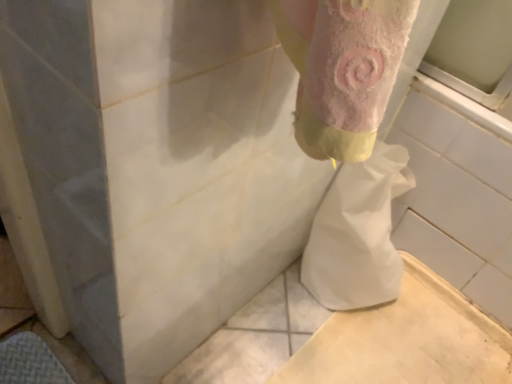
Find the location of a particular element. The image size is (512, 384). white matte porcelain at lower right is located at coordinates (406, 340).

Describe the element at coordinates (406, 340) in the screenshot. I see `white matte porcelain at lower right` at that location.

Where is `white matte porcelain at lower right`? This screenshot has width=512, height=384. white matte porcelain at lower right is located at coordinates (406, 340).